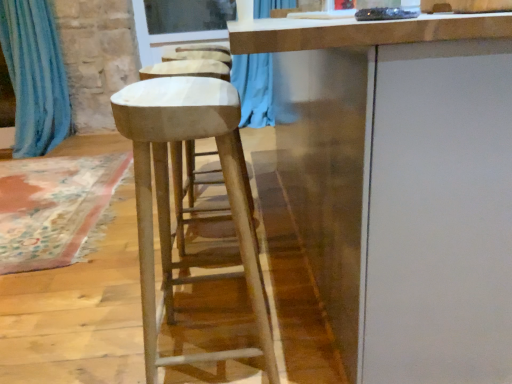
Question: Choose the correct answer: Is smooth white stool at center inside blue fabric curtain at left or outside it?

Choices:
 (A) inside
 (B) outside

Answer: (B)

Question: Is smooth white stool at center wider or thinner than blue fabric curtain at left?

Choices:
 (A) wide
 (B) thin

Answer: (A)

Question: Which is nearer to the blue fabric curtain at left?

Choices:
 (A) smooth white stool at center
 (B) transparent glass window screen at upper center
 (C) white matte cabinet at center

Answer: (B)

Question: Based on their relative distances, which object is nearer to the smooth white stool at center?

Choices:
 (A) transparent glass window screen at upper center
 (B) blue fabric curtain at left
 (C) white matte cabinet at center

Answer: (C)